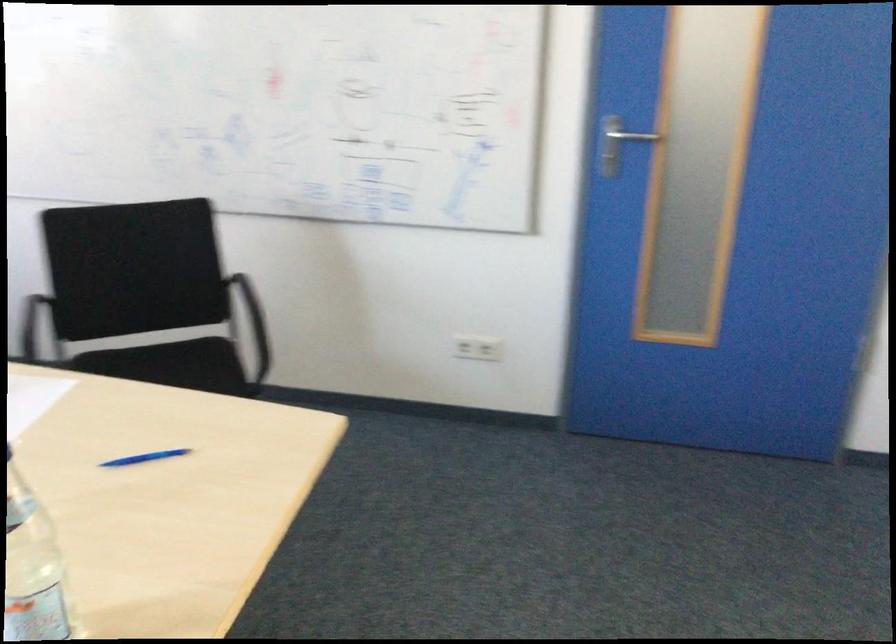
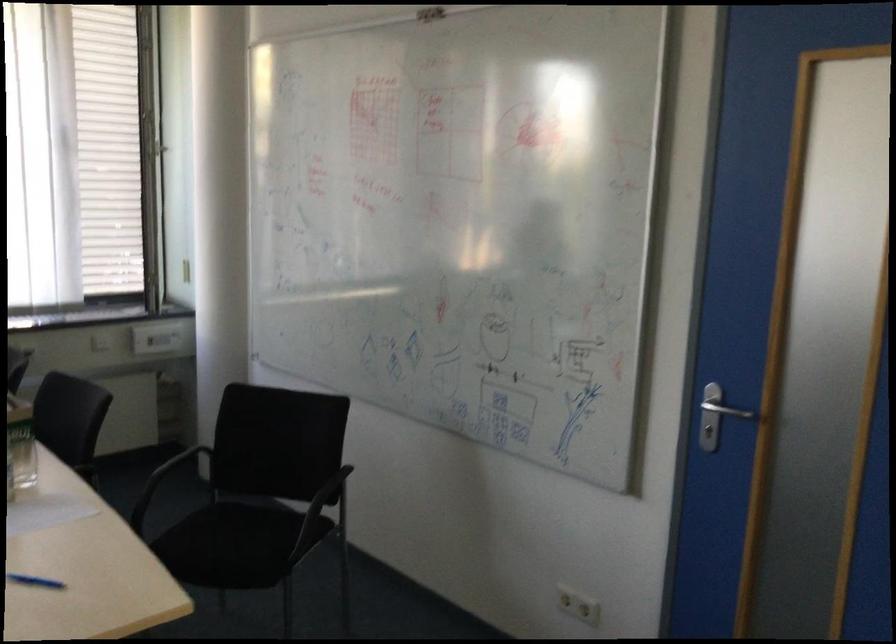
The point at (614, 144) is marked in the first image. Where is the corresponding point in the second image?

(716, 415)